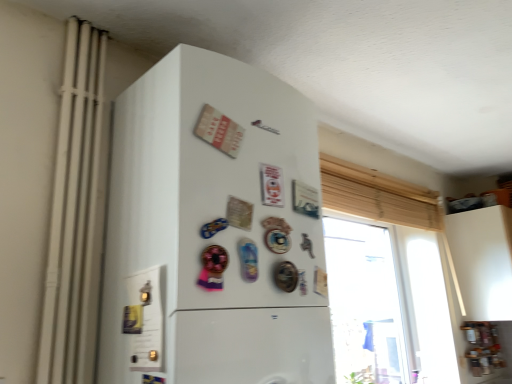
Where is `white matte refrigerator at center`? This screenshot has height=384, width=512. white matte refrigerator at center is located at coordinates (214, 230).

At what (x,y) coordinates should I click in order to perform the action: click on white matte radiator at left. Please return your answer as a coordinate pair (x, y). Looking at the image, I should click on (75, 215).

What do you see at coordinates (75, 215) in the screenshot? I see `white matte radiator at left` at bounding box center [75, 215].

This screenshot has width=512, height=384. In order to click on white matte refrigerator at center in this screenshot , I will do `click(214, 230)`.

Looking at this image, can you tell me how much translucent glass window at upper right and white matte radiator at left differ in facing direction?

The angle between the facing direction of translucent glass window at upper right and the facing direction of white matte radiator at left is 3.19 degrees.

Is translucent glass window at upper right taller or shorter than white matte radiator at left?

In the image, translucent glass window at upper right appears to be shorter than white matte radiator at left.

Can you confirm if translucent glass window at upper right is positioned to the right of white matte radiator at left?

Yes, translucent glass window at upper right is to the right of white matte radiator at left.

From a real-world perspective, relative to white matte radiator at left, is translucent glass window at upper right vertically above or below?

translucent glass window at upper right is situated lower than white matte radiator at left in the real world.

Considering the sizes of white matte radiator at left and white matte refrigerator at center in the image, is white matte radiator at left taller or shorter than white matte refrigerator at center?

In the image, white matte radiator at left appears to be taller than white matte refrigerator at center.

Based on their positions, is white matte radiator at left located to the left or right of white matte refrigerator at center?

white matte radiator at left is positioned on white matte refrigerator at center's left side.

From a real-world perspective, is white matte radiator at left under white matte refrigerator at center?

Actually, white matte radiator at left is physically above white matte refrigerator at center in the real world.

Considering the points (76, 322) and (309, 157), which point is in front, point (76, 322) or point (309, 157)?

Point (76, 322)

Considering the sizes of objects white matte refrigerator at center and translucent glass window at upper right in the image provided, who is smaller, white matte refrigerator at center or translucent glass window at upper right?

Smaller between the two is translucent glass window at upper right.

Can you confirm if white matte refrigerator at center is shorter than translucent glass window at upper right?

No.

Considering the relative sizes of white matte refrigerator at center and translucent glass window at upper right in the image provided, is white matte refrigerator at center thinner than translucent glass window at upper right?

Incorrect, the width of white matte refrigerator at center is not less than that of translucent glass window at upper right.

Which is in front, white matte refrigerator at center or translucent glass window at upper right?

white matte refrigerator at center.

Which object is wider, white matte refrigerator at center or white matte radiator at left?

white matte refrigerator at center.

From a real-world perspective, is white matte refrigerator at center below white matte radiator at left?

Yes, from a real-world perspective, white matte refrigerator at center is under white matte radiator at left.

What's the angular difference between white matte refrigerator at center and white matte radiator at left's facing directions?

The angular difference between white matte refrigerator at center and white matte radiator at left is 0.0265 degrees.

Which object is positioned more to the left, white matte refrigerator at center or white matte radiator at left?

From the viewer's perspective, white matte radiator at left appears more on the left side.

Considering the relative sizes of translucent glass window at upper right and white matte refrigerator at center in the image provided, is translucent glass window at upper right wider than white matte refrigerator at center?

In fact, translucent glass window at upper right might be narrower than white matte refrigerator at center.

Is translucent glass window at upper right taller than white matte refrigerator at center?

No, translucent glass window at upper right is not taller than white matte refrigerator at center.

In the scene shown: Is translucent glass window at upper right oriented away from white matte refrigerator at center?

No, translucent glass window at upper right is not facing the opposite direction of white matte refrigerator at center.

From a real-world perspective, is white matte radiator at left positioned over translucent glass window at upper right based on gravity?

Yes, from a real-world perspective, white matte radiator at left is over translucent glass window at upper right

Between white matte radiator at left and translucent glass window at upper right, which one has smaller size?

With smaller size is white matte radiator at left.

Is white matte radiator at left situated inside translucent glass window at upper right or outside?

white matte radiator at left is outside translucent glass window at upper right.

Is there a large distance between white matte radiator at left and translucent glass window at upper right?

white matte radiator at left is far away from translucent glass window at upper right.

What are the coordinates of `radiator in front of the translucent glass window at upper right` in the screenshot? It's located at (75, 215).

Locate an element on the screen. This screenshot has height=384, width=512. refrigerator below the white matte radiator at left (from the image's perspective) is located at coordinates (214, 230).

Based on their spatial positions, is white matte refrigerator at center or translucent glass window at upper right closer to white matte radiator at left?

The object closer to white matte radiator at left is white matte refrigerator at center.

Considering their positions, is white matte radiator at left positioned closer to white matte refrigerator at center than translucent glass window at upper right?

white matte radiator at left is closer to white matte refrigerator at center.

Looking at the image, which one is located further to translucent glass window at upper right, white matte refrigerator at center or white matte radiator at left?

Based on the image, white matte radiator at left appears to be further to translucent glass window at upper right.

Considering their positions, is translucent glass window at upper right positioned closer to white matte refrigerator at center than white matte radiator at left?

Based on the image, white matte radiator at left appears to be nearer to white matte refrigerator at center.

When comparing their distances from translucent glass window at upper right, does white matte radiator at left or white matte refrigerator at center seem closer?

The object closer to translucent glass window at upper right is white matte refrigerator at center.

From the image, which object appears to be farther from white matte radiator at left, translucent glass window at upper right or white matte refrigerator at center?

translucent glass window at upper right is further to white matte radiator at left.

Where is `refrigerator situated between white matte radiator at left and translucent glass window at upper right from left to right`? refrigerator situated between white matte radiator at left and translucent glass window at upper right from left to right is located at coordinates (214, 230).